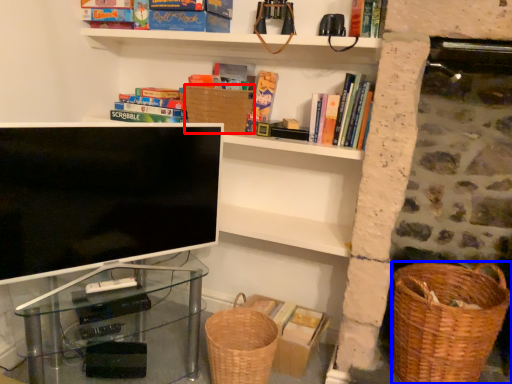
Question: Which of the following is the closest to the observer, basket (highlighted by a red box) or basket container (highlighted by a blue box)?

Choices:
 (A) basket
 (B) basket container

Answer: (B)